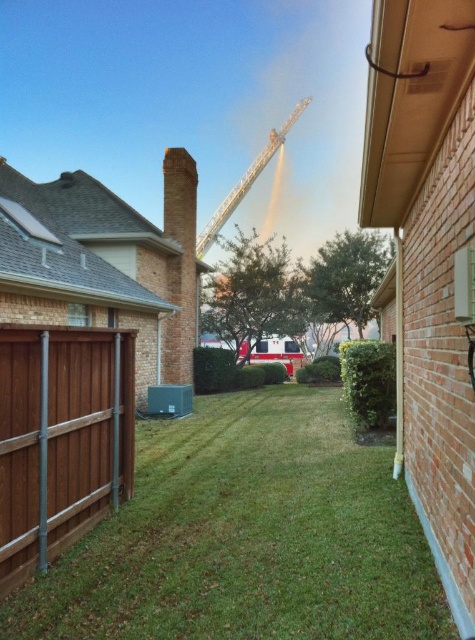
You are a firefighter arriving at this backyard scene. You need to quickly assess the situation. Which object, the brown wood fence at lower left or the brick chimney at center, is smaller in size and might require closer inspection for potential hazards?

The brown wood fence at lower left is smaller in size compared to the brick chimney at center, so it might require closer inspection for potential hazards.

You are a firefighter trying to reach the fire truck parked near the center of the backyard. You are currently standing on the green grass at center. Which direction should you move to avoid the metallic silver crane at upper center blocking your path?

The green grass at center is in front of the metallic silver crane at upper center, so moving forward from the green grass at center would lead you away from the crane. Therefore, you should move forward to avoid the metallic silver crane at upper center blocking your path.